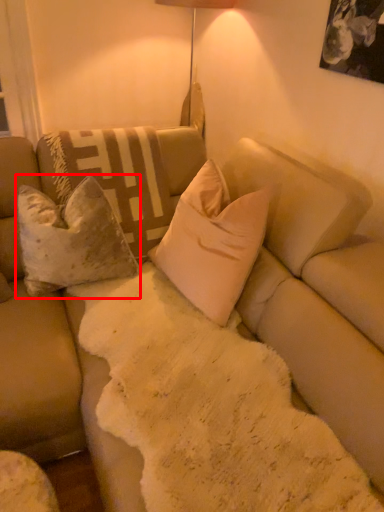
Question: Considering the relative positions of pillow (annotated by the red box) and pillow in the image provided, where is pillow (annotated by the red box) located with respect to the staircase?

Choices:
 (A) left
 (B) right

Answer: (A)